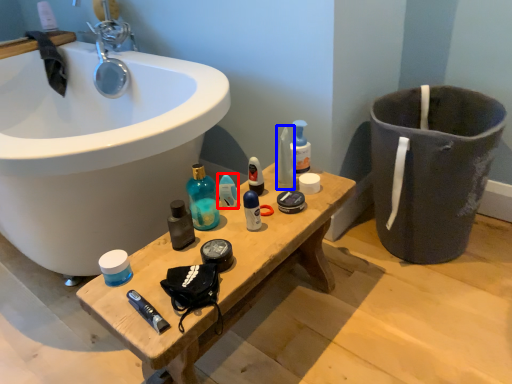
Question: Which object appears farthest to the camera in this image, toiletry (highlighted by a red box) or toiletry (highlighted by a blue box)?

Choices:
 (A) toiletry
 (B) toiletry

Answer: (B)